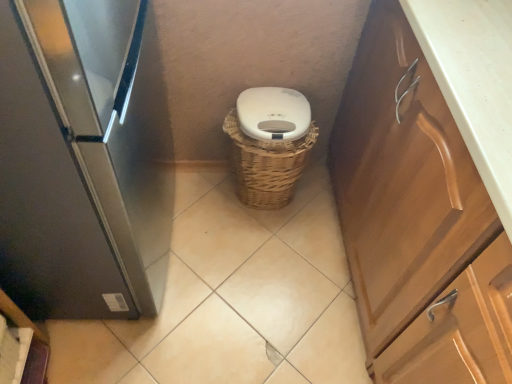
Question: From the image's perspective, is white matte toilet bowl at center above wooden cabinet at right?

Choices:
 (A) no
 (B) yes

Answer: (B)

Question: Would you say white matte toilet bowl at center is a long distance from wooden cabinet at right?

Choices:
 (A) no
 (B) yes

Answer: (A)

Question: From a real-world perspective, does white matte toilet bowl at center sit lower than wooden cabinet at right?

Choices:
 (A) no
 (B) yes

Answer: (B)

Question: Considering the relative sizes of white matte toilet bowl at center and wooden cabinet at right in the image provided, is white matte toilet bowl at center shorter than wooden cabinet at right?

Choices:
 (A) yes
 (B) no

Answer: (A)

Question: Is white matte toilet bowl at center smaller than wooden cabinet at right?

Choices:
 (A) yes
 (B) no

Answer: (A)

Question: From the image's perspective, is satin black refrigerator at left located above or below wooden cabinet at right?

Choices:
 (A) below
 (B) above

Answer: (B)

Question: Considering the positions of satin black refrigerator at left and wooden cabinet at right in the image, is satin black refrigerator at left wider or thinner than wooden cabinet at right?

Choices:
 (A) wide
 (B) thin

Answer: (B)

Question: Considering their positions, is satin black refrigerator at left located in front of or behind wooden cabinet at right?

Choices:
 (A) front
 (B) behind

Answer: (A)

Question: Based on their sizes in the image, would you say satin black refrigerator at left is bigger or smaller than wooden cabinet at right?

Choices:
 (A) small
 (B) big

Answer: (A)

Question: Considering the positions of white matte toilet bowl at center and satin black refrigerator at left in the image, is white matte toilet bowl at center wider or thinner than satin black refrigerator at left?

Choices:
 (A) thin
 (B) wide

Answer: (A)

Question: From their relative heights in the image, would you say white matte toilet bowl at center is taller or shorter than satin black refrigerator at left?

Choices:
 (A) tall
 (B) short

Answer: (B)

Question: From a real-world perspective, relative to satin black refrigerator at left, is white matte toilet bowl at center vertically above or below?

Choices:
 (A) above
 (B) below

Answer: (B)

Question: In the image, is white matte toilet bowl at center positioned in front of or behind satin black refrigerator at left?

Choices:
 (A) front
 (B) behind

Answer: (B)

Question: Is satin black refrigerator at left taller or shorter than woven brown basket at center?

Choices:
 (A) short
 (B) tall

Answer: (B)

Question: Looking at their shapes, would you say satin black refrigerator at left is wider or thinner than woven brown basket at center?

Choices:
 (A) wide
 (B) thin

Answer: (B)